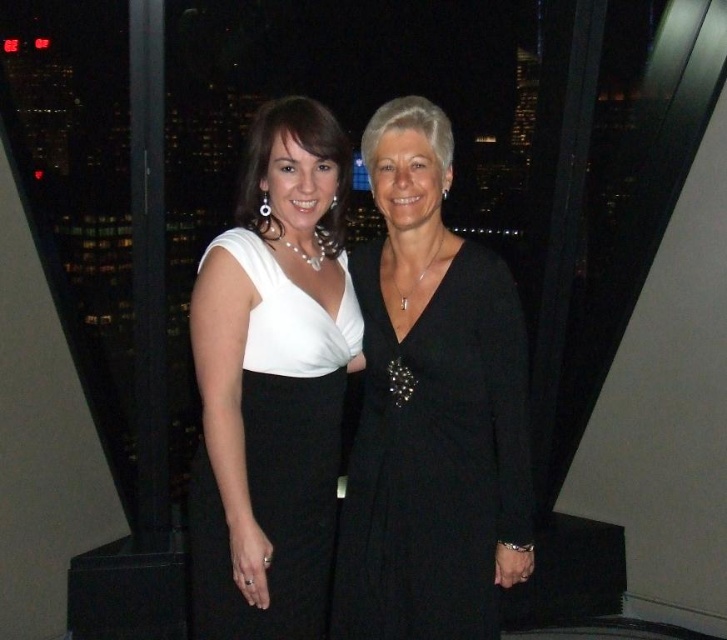
Question: Observing the image, what is the correct spatial positioning of black satin dress at center in reference to white satin dress at center?

Choices:
 (A) below
 (B) above

Answer: (B)

Question: Is black satin dress at center to the left of white satin dress at center from the viewer's perspective?

Choices:
 (A) yes
 (B) no

Answer: (B)

Question: Can you confirm if black satin dress at center is positioned above white satin dress at center?

Choices:
 (A) no
 (B) yes

Answer: (B)

Question: Among these objects, which one is farthest from the camera?

Choices:
 (A) black satin dress at center
 (B) white satin dress at center

Answer: (A)

Question: Which object appears closest to the camera in this image?

Choices:
 (A) white satin dress at center
 (B) black satin dress at center

Answer: (A)